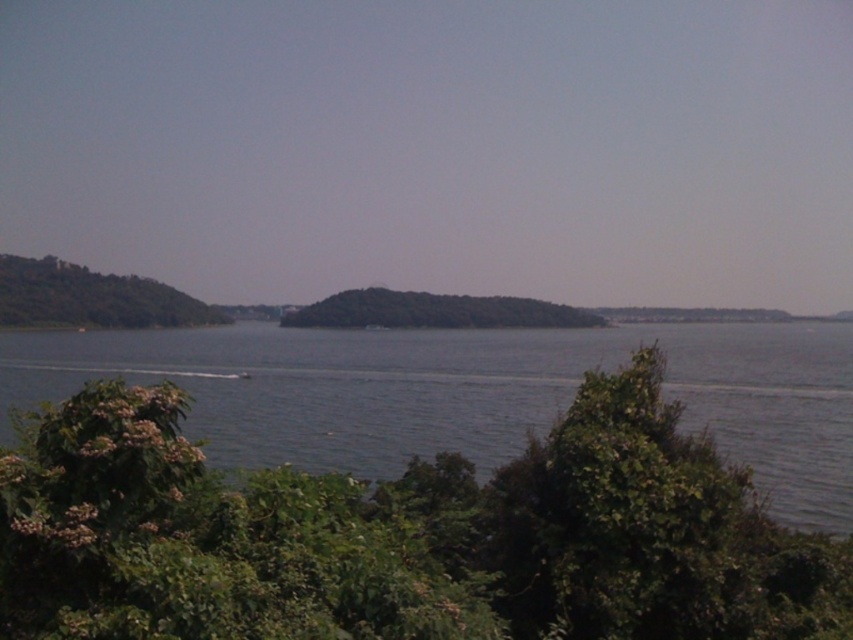
Is green leafy bush at lower center shorter than green leafy tree at left?

Indeed, green leafy bush at lower center has a lesser height compared to green leafy tree at left.

Between point (529, 496) and point (71, 300), which one is positioned behind?

The point (71, 300) is behind.

The width and height of the screenshot is (853, 640). What do you see at coordinates (402, 534) in the screenshot?
I see `green leafy bush at lower center` at bounding box center [402, 534].

Where is `green leafy bush at lower center`? green leafy bush at lower center is located at coordinates (402, 534).

Is green leafy tree at left in front of green leafy hill at center?

Yes, green leafy tree at left is in front of green leafy hill at center.

Between point (59, 316) and point (410, 326), which one is positioned behind?

Positioned behind is point (59, 316).

This screenshot has width=853, height=640. What do you see at coordinates (91, 298) in the screenshot? I see `green leafy tree at left` at bounding box center [91, 298].

At what (x,y) coordinates should I click in order to perform the action: click on green leafy tree at left. Please return your answer as a coordinate pair (x, y). Looking at the image, I should click on (91, 298).

Is green leafy bush at lower center further to camera compared to green leafy hill at center?

No.

In the scene shown: Does green leafy bush at lower center lie in front of green leafy hill at center?

Yes, green leafy bush at lower center is in front of green leafy hill at center.

At what (x,y) coordinates should I click in order to perform the action: click on green leafy bush at lower center. Please return your answer as a coordinate pair (x, y). This screenshot has height=640, width=853. Looking at the image, I should click on (402, 534).